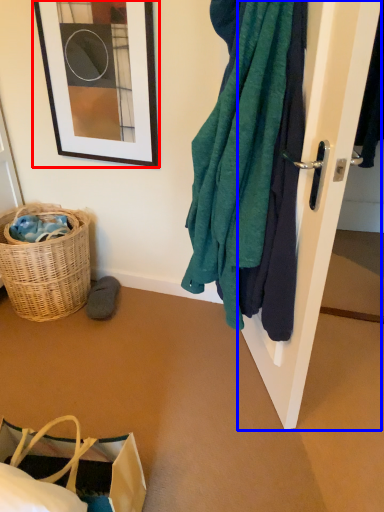
Question: Which point is further to the camera, picture frame (highlighted by a red box) or door (highlighted by a blue box)?

Choices:
 (A) picture frame
 (B) door

Answer: (A)